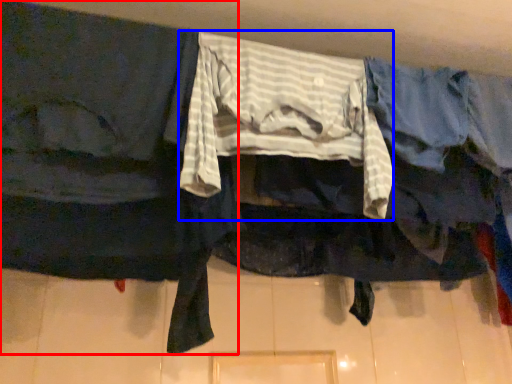
Question: Which object is further to the camera taking this photo, robe (highlighted by a red box) or clothing (highlighted by a blue box)?

Choices:
 (A) robe
 (B) clothing

Answer: (B)